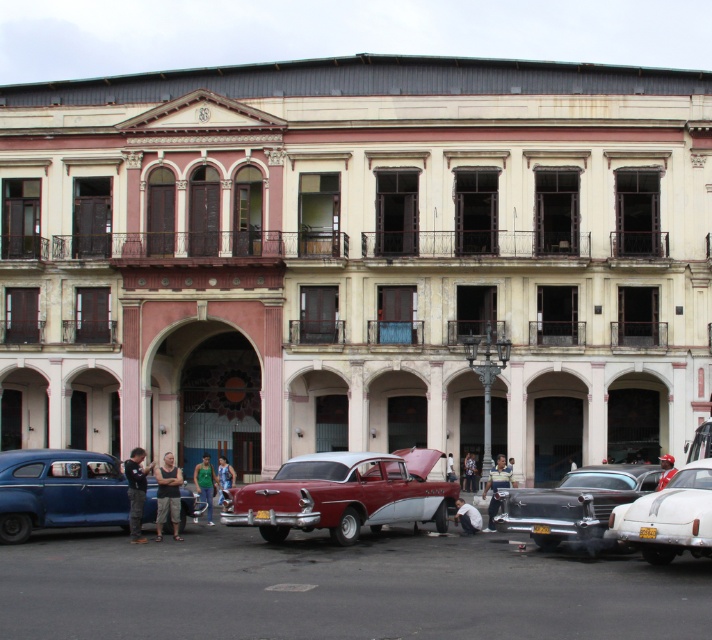
How far apart are striped shirt at center and dark blue jeans at center?

A distance of 8.44 meters exists between striped shirt at center and dark blue jeans at center.

Between striped shirt at center and dark blue jeans at center, which one is positioned higher?

striped shirt at center

Find the location of a particular element. striped shirt at center is located at coordinates (496, 486).

Which is below, dark gray tank top at center or dark blue shirt at lower left?

Positioned lower is dark gray tank top at center.

Between dark gray tank top at center and dark blue shirt at lower left, which one appears on the right side from the viewer's perspective?

Positioned to the right is dark gray tank top at center.

Which is behind, point (172, 499) or point (145, 481)?

Positioned behind is point (172, 499).

You are a GUI agent. You are given a task and a screenshot of the screen. Output one action in this format:
    pyautogui.click(x=<x>, y=<y>)
    Task: Click on the dark gray tank top at center
    Image resolution: width=712 pixels, height=640 pixels.
    Given the screenshot: What is the action you would take?
    pyautogui.click(x=167, y=496)

Is point (562, 628) closer to camera compared to point (468, 529)?

Yes.

Looking at this image, who is higher up, shiny chrome car at lower center or light blue jeans at center?

shiny chrome car at lower center is above.

Locate an element on the screen. The width and height of the screenshot is (712, 640). shiny chrome car at lower center is located at coordinates coord(337,588).